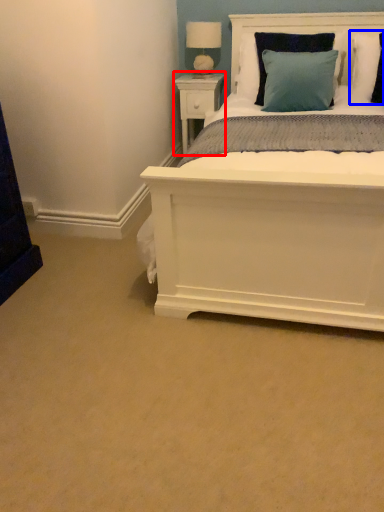
Question: Among these objects, which one is nearest to the camera, nightstand (highlighted by a red box) or pillow (highlighted by a blue box)?

Choices:
 (A) nightstand
 (B) pillow

Answer: (B)